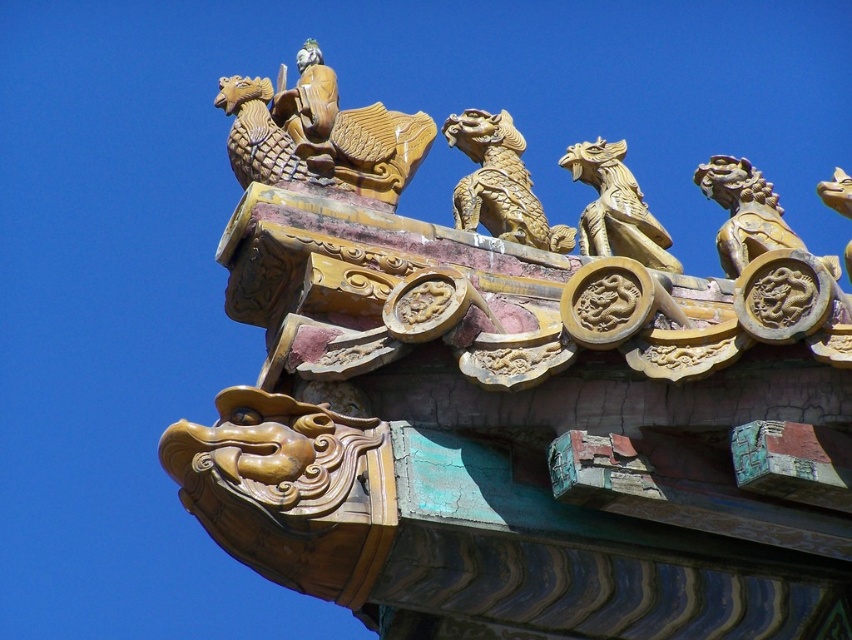
Question: Is gold textured dragon at upper center to the right of gold carved dragon at center from the viewer's perspective?

Choices:
 (A) no
 (B) yes

Answer: (A)

Question: Estimate the real-world distances between objects in this image. Which object is closer to the gold/gilded dragon at upper center?

Choices:
 (A) gold carved dragon at center
 (B) gold textured dragon at upper center

Answer: (B)

Question: Which of the following is the closest to the observer?

Choices:
 (A) (376, 172)
 (B) (607, 144)

Answer: (A)

Question: Does gold/gilded dragon at upper center have a larger size compared to gold carved dragon at center?

Choices:
 (A) no
 (B) yes

Answer: (B)

Question: Which point is farther to the camera?

Choices:
 (A) gold textured dragon at upper center
 (B) gold/gilded dragon at upper center
 (C) gold carved dragon at center

Answer: (C)

Question: Is the position of gold/gilded dragon at upper center more distant than that of gold textured dragon at upper center?

Choices:
 (A) no
 (B) yes

Answer: (A)